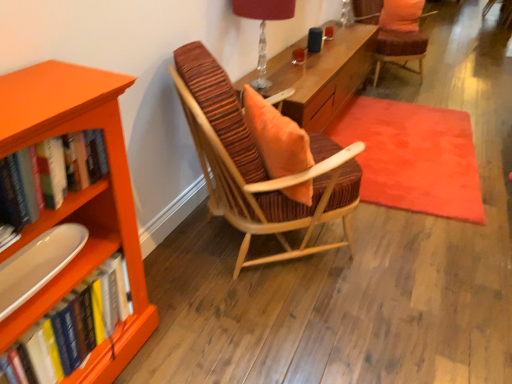
Question: Is hardcover books at left, positioned as the 1th book in top-to-bottom order, situated inside translucent glass table lamp at upper center or outside?

Choices:
 (A) inside
 (B) outside

Answer: (B)

Question: In terms of height, does hardcover books at left, the second book in the bottom-to-top sequence, look taller or shorter compared to translucent glass table lamp at upper center?

Choices:
 (A) tall
 (B) short

Answer: (B)

Question: Which is farther from the striped fabric chair at center, the 2th chair viewed from the back?

Choices:
 (A) hardcover books at left, the second book in the bottom-to-top sequence
 (B) matte white tray at lower left
 (C) translucent glass table lamp at upper center
 (D) velvet orange cushioned chair at upper right, arranged as the 1th chair when viewed from the top
 (E) orange matte bookcase at left

Answer: (D)

Question: Estimate the real-world distances between objects in this image. Which object is closer to the translucent glass table lamp at upper center?

Choices:
 (A) orange matte bookcase at left
 (B) striped fabric chair at center, the first chair from the left
 (C) hardcover books at left, the second book in the bottom-to-top sequence
 (D) matte white tray at lower left
 (E) velvet orange rug at center

Answer: (B)